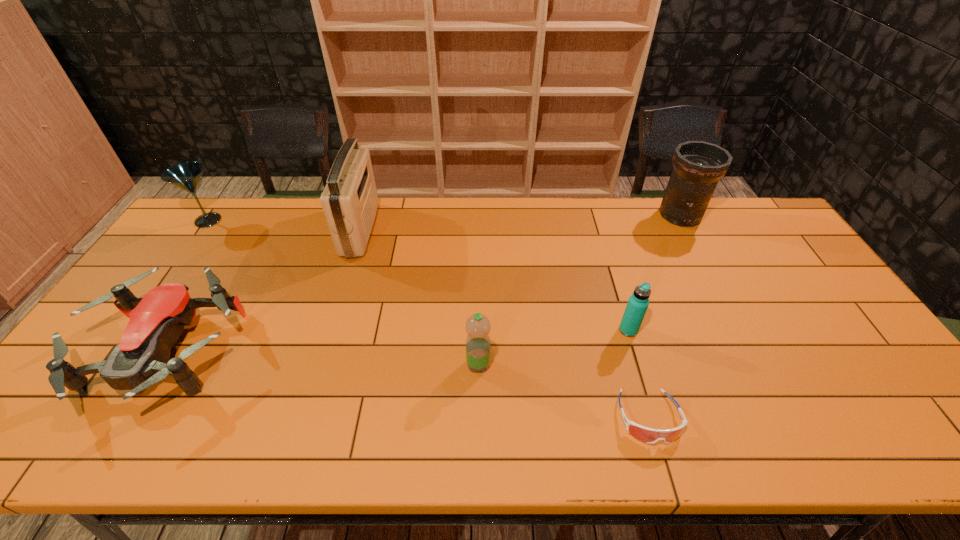
Identify the location of free space located on the front of the telephoto lens. (696, 246).

Find the location of `blank space located on the right of the martini`. blank space located on the right of the martini is located at coordinates (241, 220).

Where is `vacant space situated 0.310m on the back of the fourth object from left to right`? The height and width of the screenshot is (540, 960). vacant space situated 0.310m on the back of the fourth object from left to right is located at coordinates (479, 271).

Locate an element on the screen. This screenshot has width=960, height=540. vacant area situated 0.340m on the right of the right water bottle is located at coordinates (764, 330).

Find the location of a particular element. Image resolution: width=960 pixels, height=540 pixels. radio receiver that is positioned at the far edge is located at coordinates (349, 200).

This screenshot has width=960, height=540. Find the location of `telephoto lens positioned at the far edge`. telephoto lens positioned at the far edge is located at coordinates (x=697, y=165).

Where is `martini present at the far edge`? The height and width of the screenshot is (540, 960). martini present at the far edge is located at coordinates (186, 175).

The image size is (960, 540). I want to click on drone at the near edge, so click(141, 359).

Identify the location of goggles that is at the near edge. (648, 435).

Where is `martini positioned at the left edge`? The image size is (960, 540). martini positioned at the left edge is located at coordinates (186, 175).